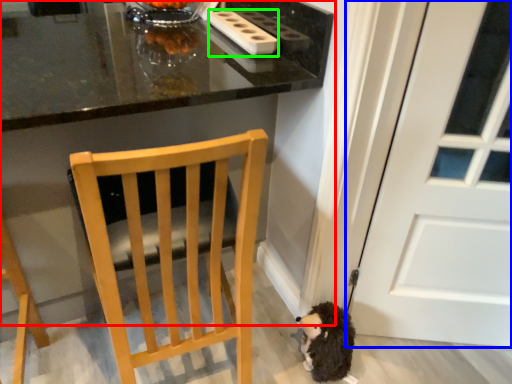
Question: Which object is the closest to the table (highlighted by a red box)? Choose among these: door (highlighted by a blue box) or appliance (highlighted by a green box).

Choices:
 (A) door
 (B) appliance

Answer: (B)